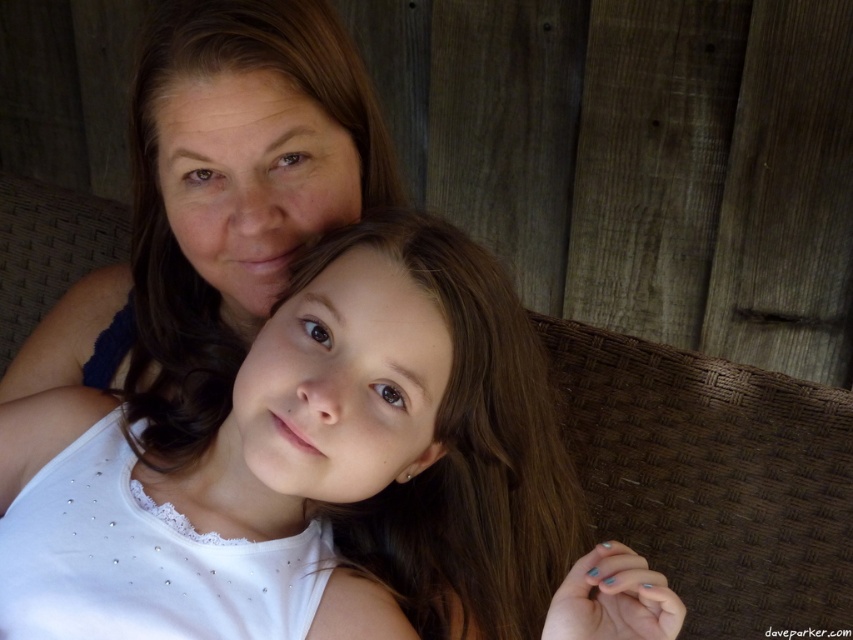
Question: Is white satin blouse at center thinner than matte blue tank top at upper left?

Choices:
 (A) yes
 (B) no

Answer: (B)

Question: Which point is closer to the camera?

Choices:
 (A) (358, 488)
 (B) (73, 333)

Answer: (A)

Question: Is white satin blouse at center further to the viewer compared to matte blue tank top at upper left?

Choices:
 (A) no
 (B) yes

Answer: (A)

Question: Among these points, which one is nearest to the camera?

Choices:
 (A) (274, 554)
 (B) (189, 90)

Answer: (A)

Question: Does white satin blouse at center lie in front of matte blue tank top at upper left?

Choices:
 (A) no
 (B) yes

Answer: (B)

Question: Which point is closer to the camera taking this photo?

Choices:
 (A) (64, 573)
 (B) (187, 44)

Answer: (A)